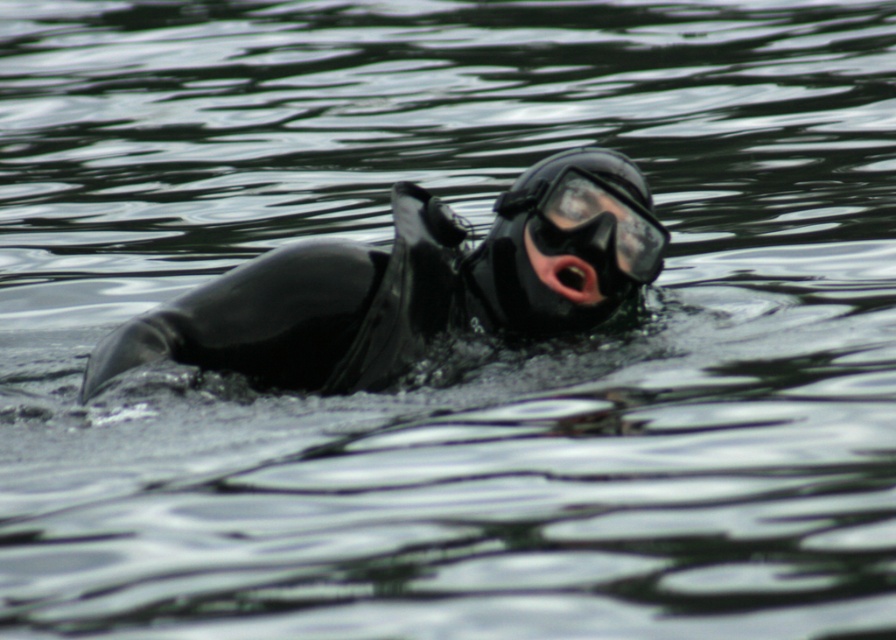
You are a lifeguard observing a diver in the water. You see the black rubber diver at center and pink matte skin at center. Which object is positioned to the left?

The black rubber diver at center is positioned to the left of the pink matte skin at center.